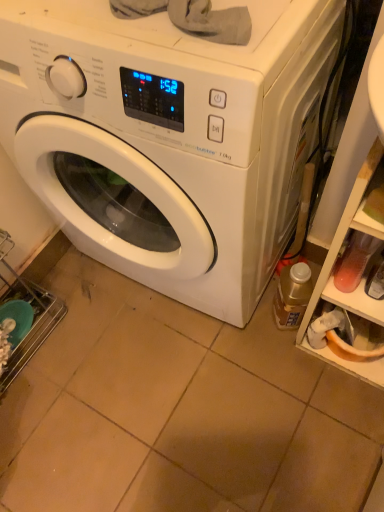
The image size is (384, 512). In order to click on free space in front of translucent plastic shelf at right in this screenshot , I will do `click(343, 411)`.